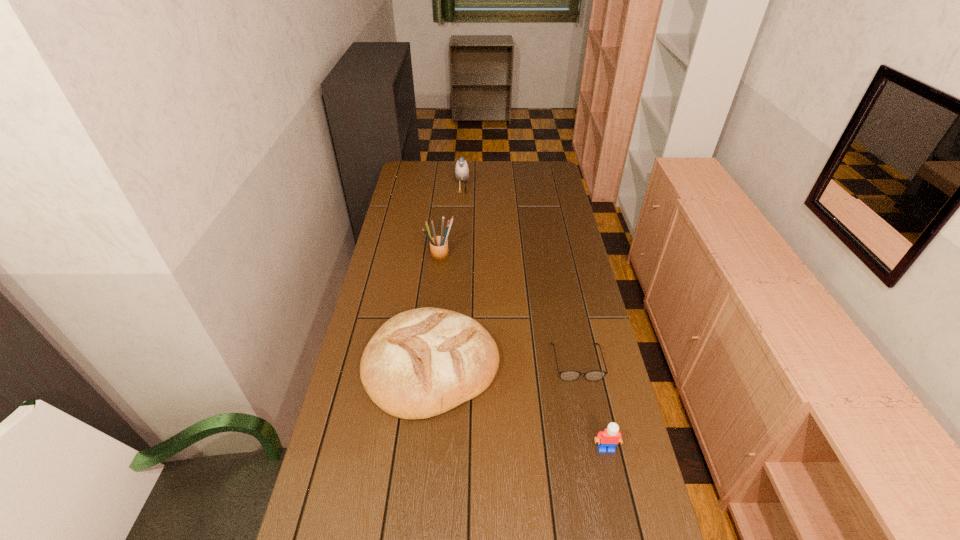
In order to click on bird in this screenshot , I will do `click(461, 168)`.

Identify the location of the second farthest object. The height and width of the screenshot is (540, 960). tap(438, 244).

Identify the location of bread. (423, 362).

You are a GUI agent. You are given a task and a screenshot of the screen. Output one action in this format:
    pyautogui.click(x=<x>, y=<y>)
    Task: Click on the Lego
    The height and width of the screenshot is (540, 960).
    Given the screenshot: What is the action you would take?
    pyautogui.click(x=609, y=438)

Locate an element on the screen. the shortest object is located at coordinates (570, 375).

Locate an element on the screen. blank space located at the tip of the farthest object's beak is located at coordinates (538, 191).

Identify the location of free space located on the front of the pencil box. This screenshot has width=960, height=540. (436, 306).

Locate an element on the screen. This screenshot has width=960, height=540. free spot located 0.080m on the front of the bread is located at coordinates click(x=422, y=451).

You are a GUI agent. You are given a task and a screenshot of the screen. Output one action in this format:
    pyautogui.click(x=<x>, y=<y>)
    Task: Click on the free space located on the face of the Lego
    Image resolution: width=960 pixels, height=540 pixels.
    Given the screenshot: What is the action you would take?
    pyautogui.click(x=623, y=526)

What are the coordinates of `vacant space located 0.300m on the front-facing side of the shortest object` in the screenshot? It's located at (602, 488).